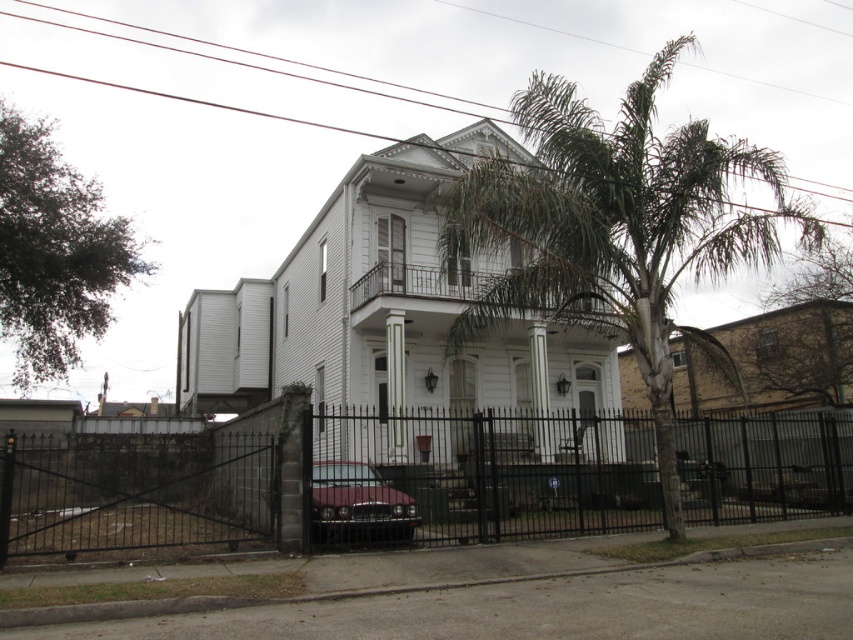
You are standing on the sidewalk in front of the house and see the green leafy palm tree at center and the shiny maroon car at center. Which object is positioned more to the right side from your perspective?

The green leafy palm tree at center is positioned more to the right side from your perspective because it is to the right of the shiny maroon car at center.

In the scene shown: You are a delivery person approaching the house and need to access the front door. The black metal fence at center and the green leafy palm tree at center are in your path. Which object is blocking your direct path to the front door?

The black metal fence at center is positioned under green leafy palm tree at center, so the green leafy palm tree at center is blocking the direct path to the front door because it is above the fence.